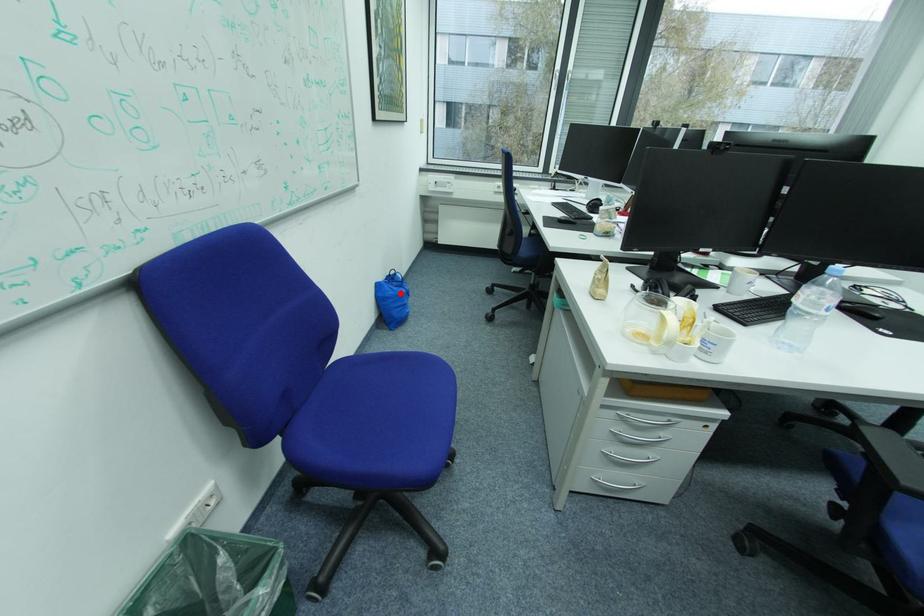
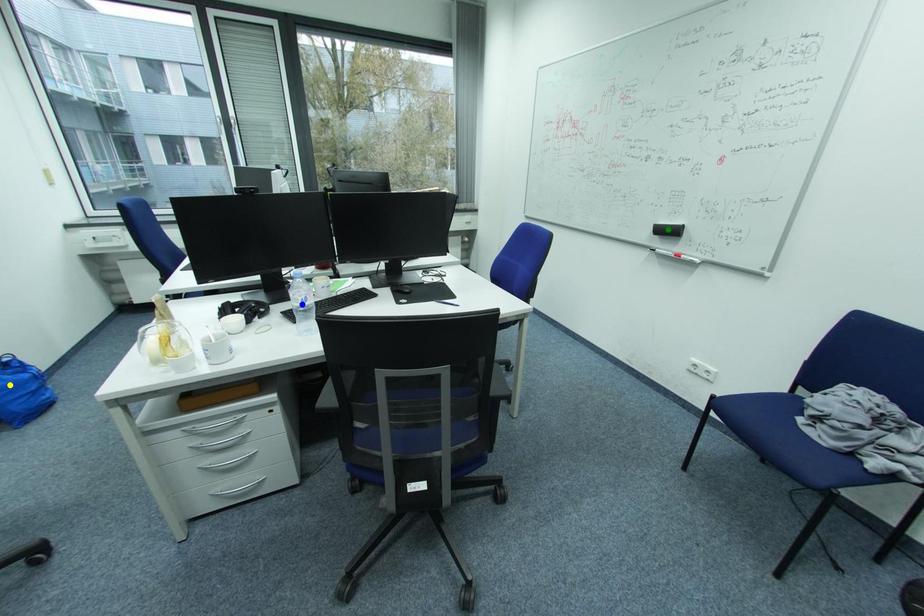
Question: I am providing you with two images of the same scene from different viewpoints. A red point is marked on the first image. You are given multiple points on the second image. In image 2, which mark is for the same physical point as the one in image 1?

Choices:
 (A) blue point
 (B) green point
 (C) yellow point

Answer: (C)